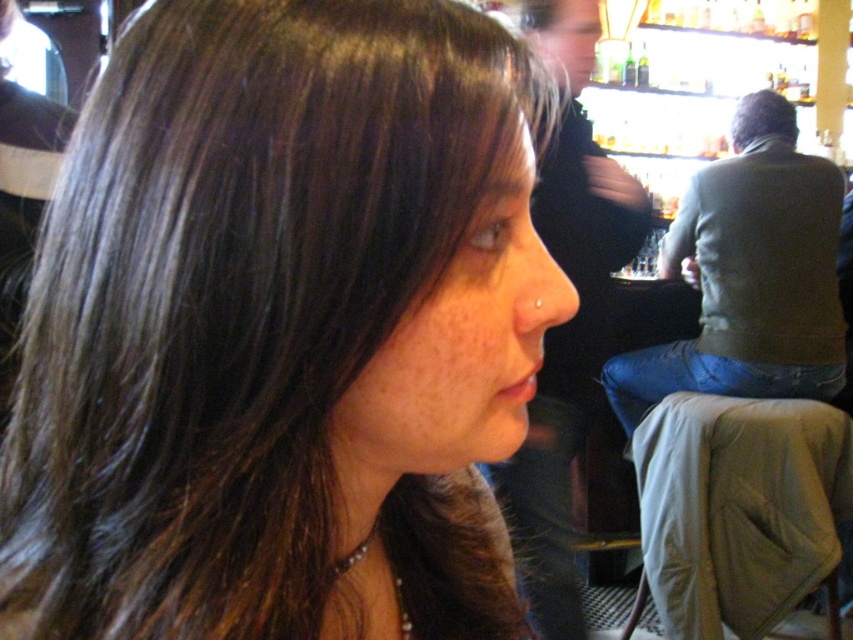
Question: Does dark brown hair at center have a smaller size compared to dark brown hair at upper right?

Choices:
 (A) yes
 (B) no

Answer: (B)

Question: Considering the relative positions of dark brown hair at center and dark brown hair at upper right in the image provided, where is dark brown hair at center located with respect to dark brown hair at upper right?

Choices:
 (A) left
 (B) right

Answer: (A)

Question: Among these points, which one is farthest from the camera?

Choices:
 (A) (457, 520)
 (B) (785, 102)

Answer: (B)

Question: Is the position of dark brown hair at center more distant than that of dark brown hair at upper right?

Choices:
 (A) yes
 (B) no

Answer: (B)

Question: Which of the following is the closest to the observer?

Choices:
 (A) (509, 131)
 (B) (757, 113)

Answer: (A)